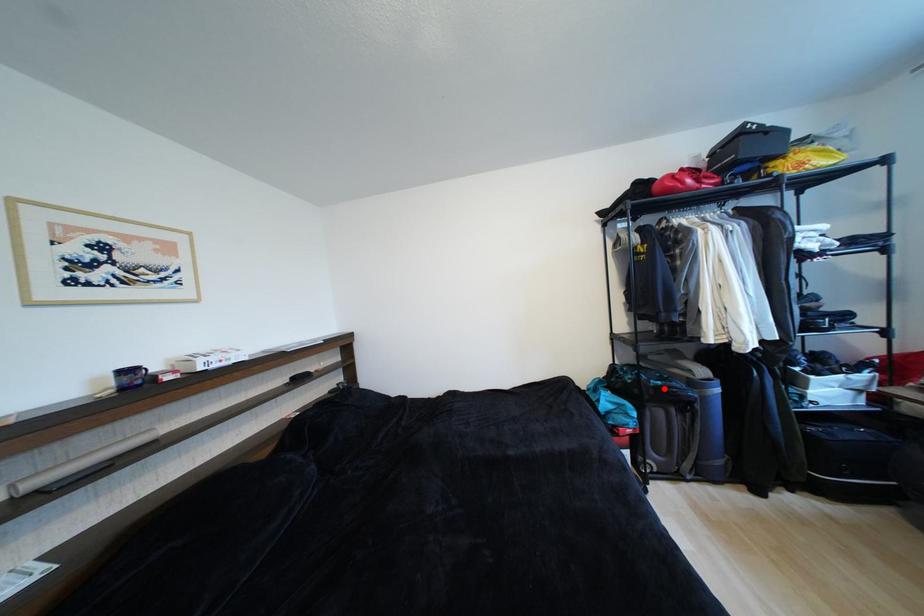
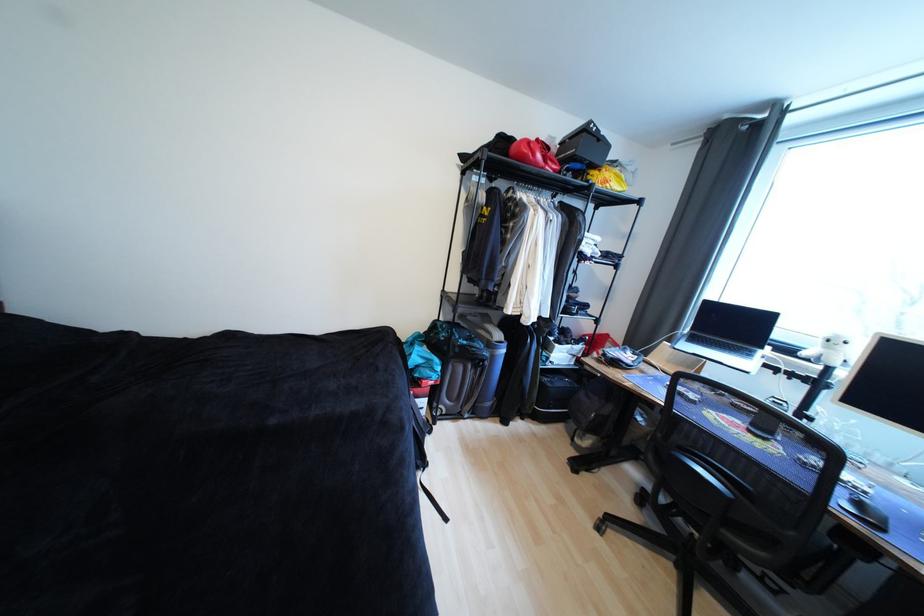
Question: I am providing you with two images of the same scene from different viewpoints. A red point is marked on the first image. Is the red point's position out of view in image 2?

Choices:
 (A) Yes
 (B) No

Answer: (B)